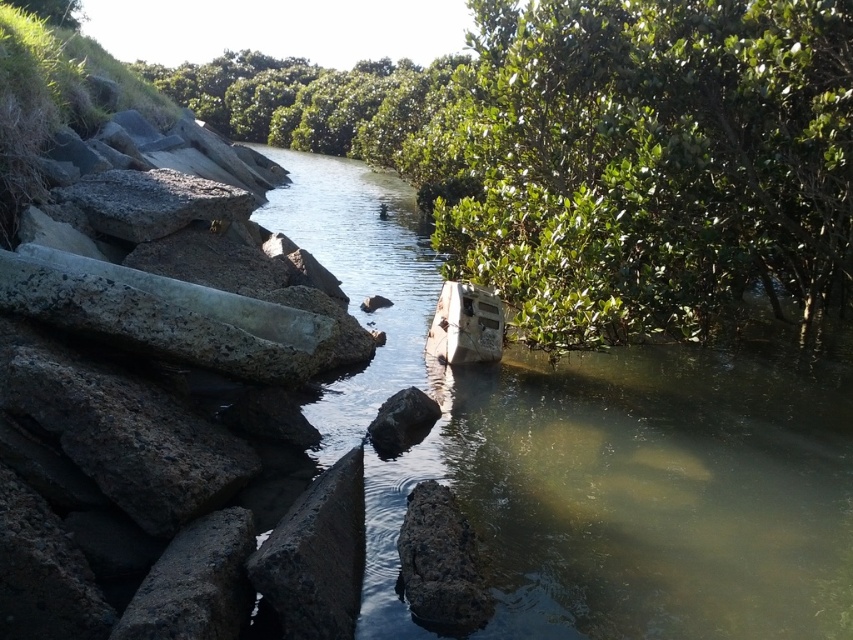
You are a construction worker inspecting the waterway and need to determine which material to use for reinforcing the bank. Given that the dark gray concrete at left and the gray rough stone at upper left are available, which one would you choose based on their size if you need a larger material for stability?

The gray rough stone at upper left is larger in size compared to the dark gray concrete at left, so it would be the better choice for reinforcing the bank due to its larger size providing better stability.

You are a landscape architect designing a new garden. You have to place a small statue between the green leafy tree at center and the smooth gray rock at center. Which object should the statue be closer to if you want it to be more noticeable?

The statue should be placed closer to the smooth gray rock at center because it occupies more space than the green leafy tree at center, making it a larger focal point in the garden design.

You are standing at the edge of the waterway and want to place a 10 feet long wooden board between the dark gray concrete at left and your current position. Is it possible to do so without the board extending beyond either end?

The distance between dark gray concrete at left and your current position is 9.30 feet. Since the wooden board is 10 feet long, it would extend beyond both ends by 0.70 feet.